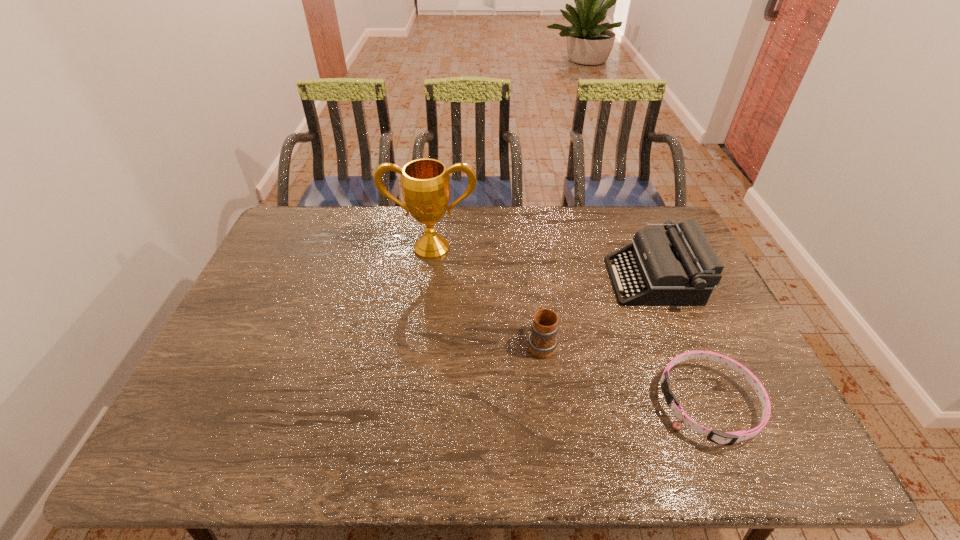
I want to click on dog collar positioned at the right edge, so click(728, 438).

What are the coordinates of `object at the near right corner` in the screenshot? It's located at (728, 438).

You are a GUI agent. You are given a task and a screenshot of the screen. Output one action in this format:
    pyautogui.click(x=<x>, y=<y>)
    Task: Click on the free space at the far edge of the desktop
    
    Given the screenshot: What is the action you would take?
    pyautogui.click(x=367, y=227)

Identify the location of vacant space at the near edge of the desktop. (316, 458).

In the image, there is a desktop. At what (x,y) coordinates should I click in order to perform the action: click on vacant region at the far left corner. Please return your answer as a coordinate pair (x, y). Image resolution: width=960 pixels, height=540 pixels. Looking at the image, I should click on (308, 234).

You are a GUI agent. You are given a task and a screenshot of the screen. Output one action in this format:
    pyautogui.click(x=<x>, y=<y>)
    Task: Click on the free space at the near left corner
    Image resolution: width=960 pixels, height=540 pixels.
    Given the screenshot: What is the action you would take?
    pyautogui.click(x=201, y=465)

Identify the location of free spot between the third farthest object and the award. The height and width of the screenshot is (540, 960). (487, 295).

The height and width of the screenshot is (540, 960). In order to click on free space between the mug and the tallest object in this screenshot , I will do `click(487, 295)`.

Locate an element on the screen. unoccupied position between the shortest object and the leftmost object is located at coordinates (570, 326).

Locate an element on the screen. free space between the typewriter and the mug is located at coordinates (597, 312).